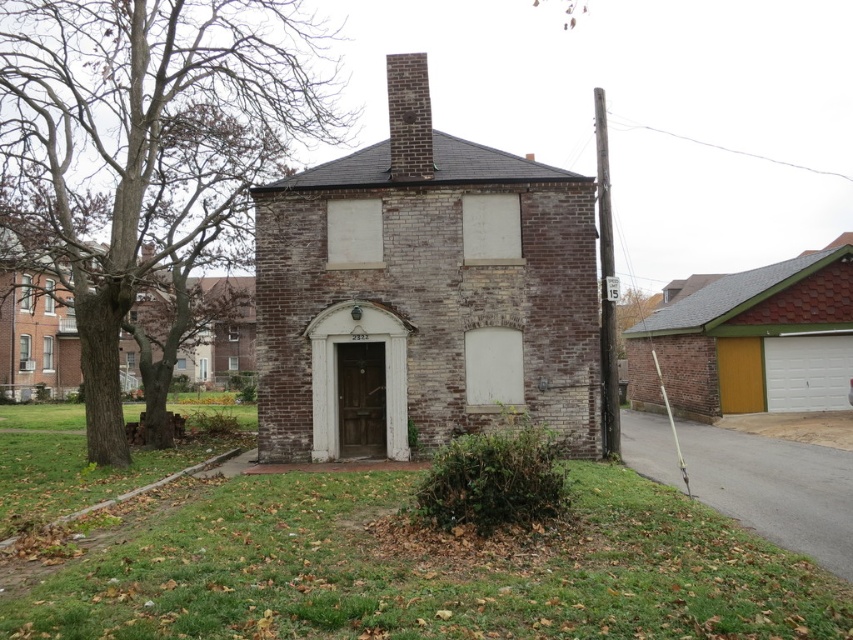
You are a delivery person trying to reach the front door of the house. You see the yellow wood garage at right and the wooden door at center. Which one is closer to the ground?

The wooden door at center is closer to the ground because the yellow wood garage at right is located above it.

You are a delivery person who needs to deliver a package to the wooden door at center. However, your delivery truck is 2 meters wide. Can you park your truck next to the yellow wood garage at right without overlapping it?

The yellow wood garage at right is wider than the wooden door at center. Since the truck is 2 meters wide, and the garage is wider, there is sufficient space to park the truck next to the yellow wood garage at right without overlapping it.

You are a delivery person with a cart that is 10 feet wide. You need to move your cart from the yellow wood garage at right to the wooden door at center. Is there enough space between them for your cart to pass through?

The yellow wood garage at right and wooden door at center are 42.75 feet apart from each other. Since the cart is only 10 feet wide, there is more than enough space for the cart to pass through between them.